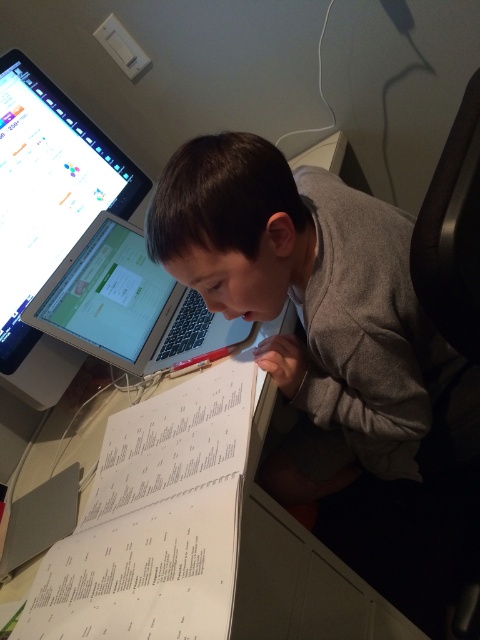
Question: Does gray cotton shirt at center appear over matte black monitor at upper left?

Choices:
 (A) yes
 (B) no

Answer: (B)

Question: Does matte black monitor at upper left have a greater width compared to silver/black plastic laptop at center?

Choices:
 (A) no
 (B) yes

Answer: (A)

Question: Can you confirm if matte black monitor at upper left is wider than silver/black plastic laptop at center?

Choices:
 (A) no
 (B) yes

Answer: (A)

Question: Estimate the real-world distances between objects in this image. Which object is farther from the gray cotton shirt at center?

Choices:
 (A) silver/black plastic laptop at center
 (B) matte black monitor at upper left
 (C) white paper at lower left

Answer: (B)

Question: Which of the following is the closest to the observer?

Choices:
 (A) (82, 241)
 (B) (6, 317)
 (C) (299, 268)
 (D) (223, 465)

Answer: (D)

Question: Which object is the closest to the white paper at lower left?

Choices:
 (A) gray cotton shirt at center
 (B) matte black monitor at upper left
 (C) silver/black plastic laptop at center

Answer: (C)